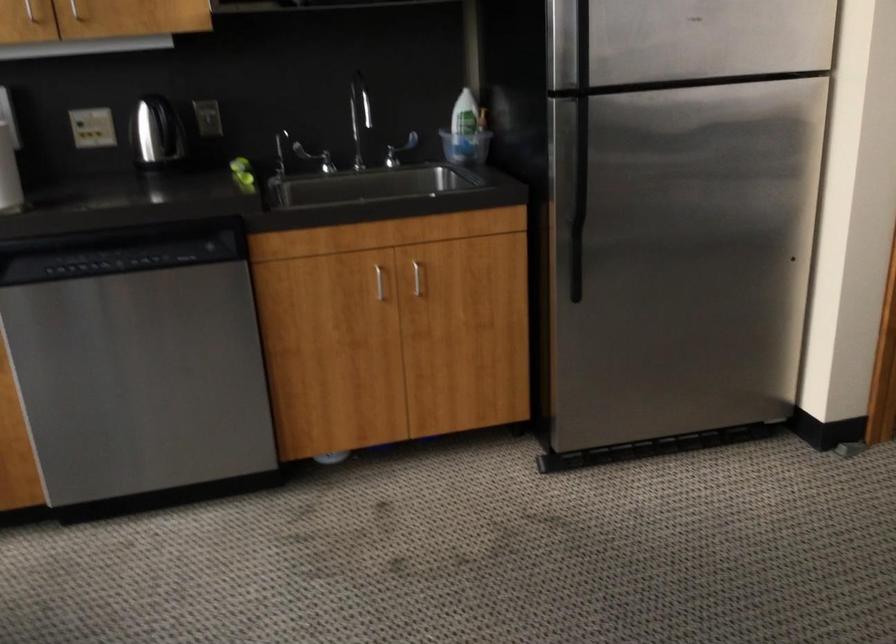
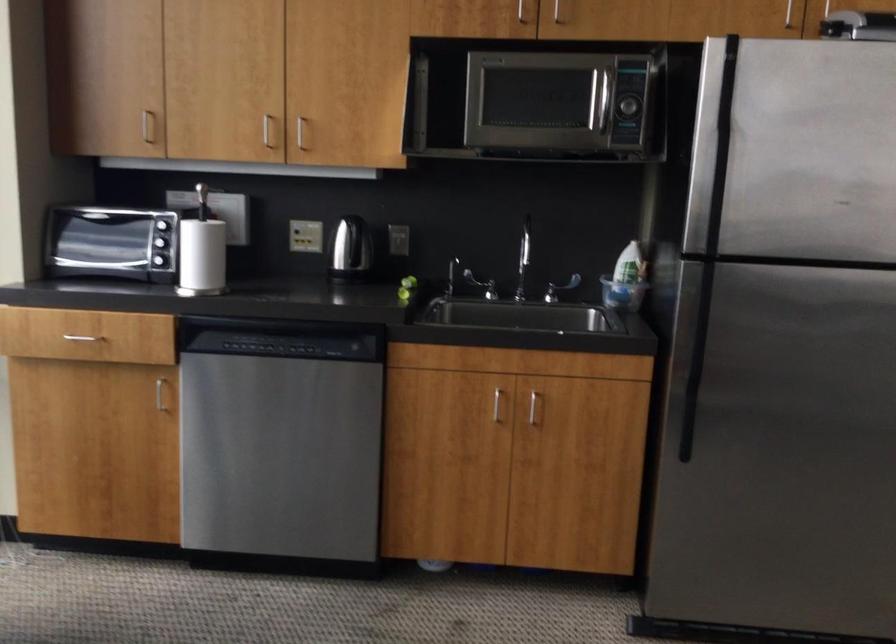
In the second image, find the point that corresponds to point 230,165 in the first image.

(409, 281)